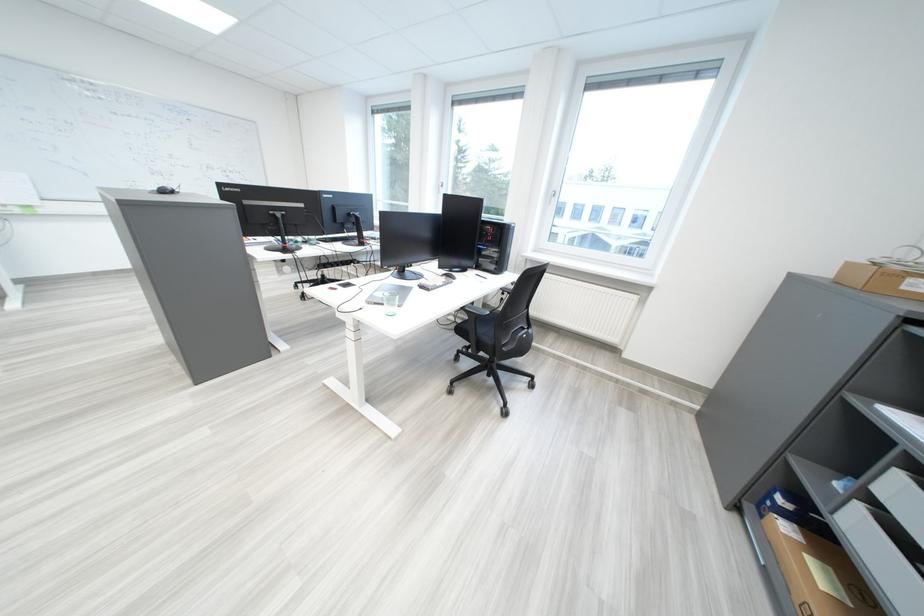
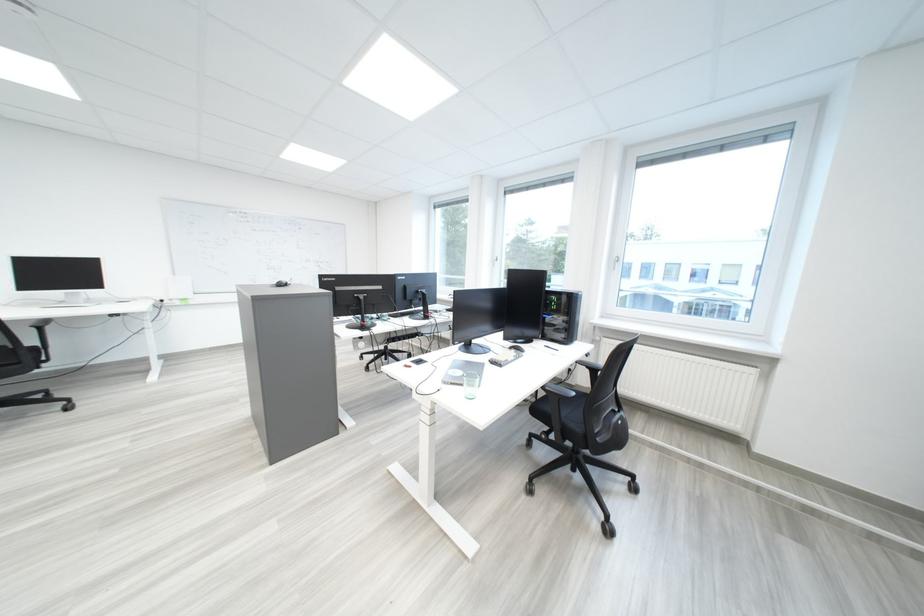
Question: What movement of the cameraman would produce the second image?

Choices:
 (A) Left
 (B) Right
 (C) Forward
 (D) Backward

Answer: (A)